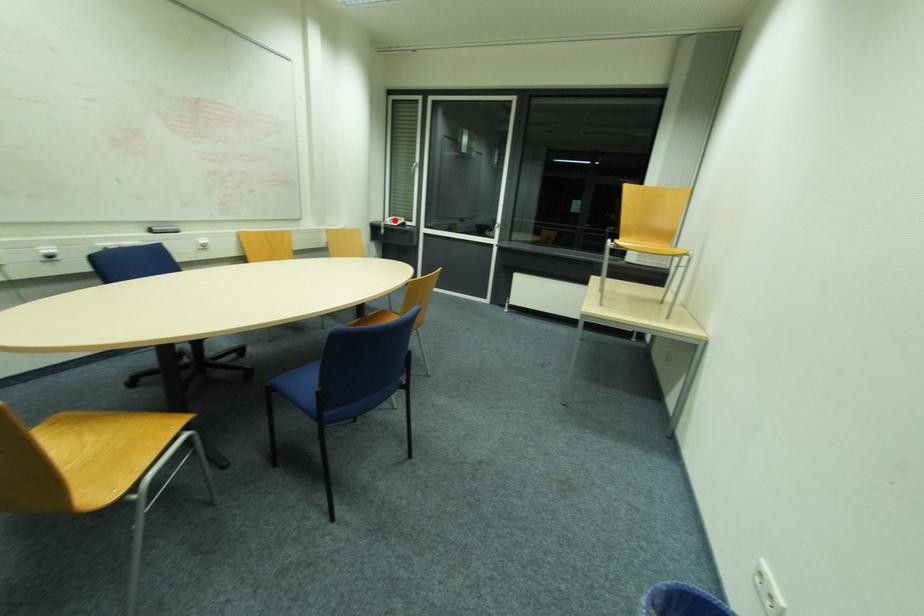
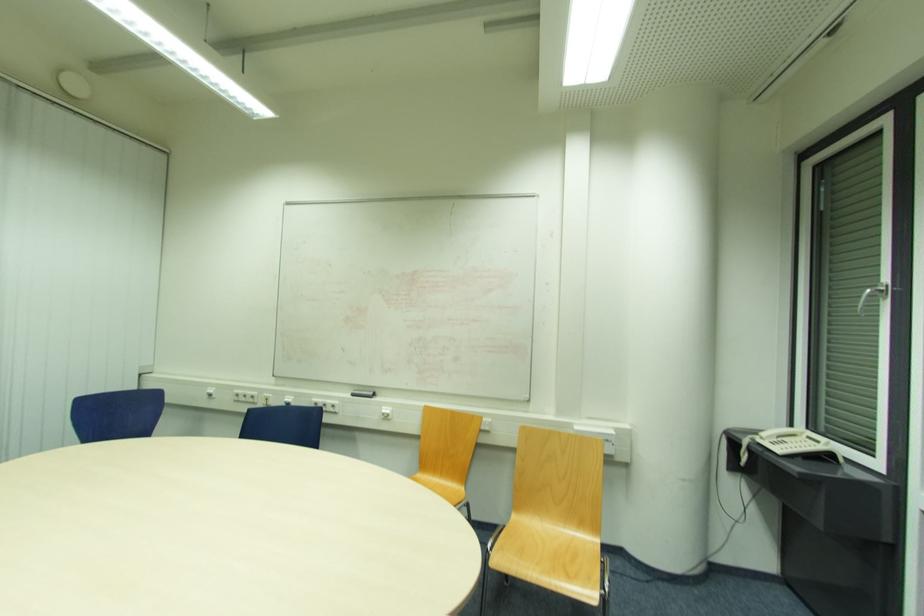
Locate, in the second image, the point that corresponds to the highlighted location in the first image.

(793, 436)